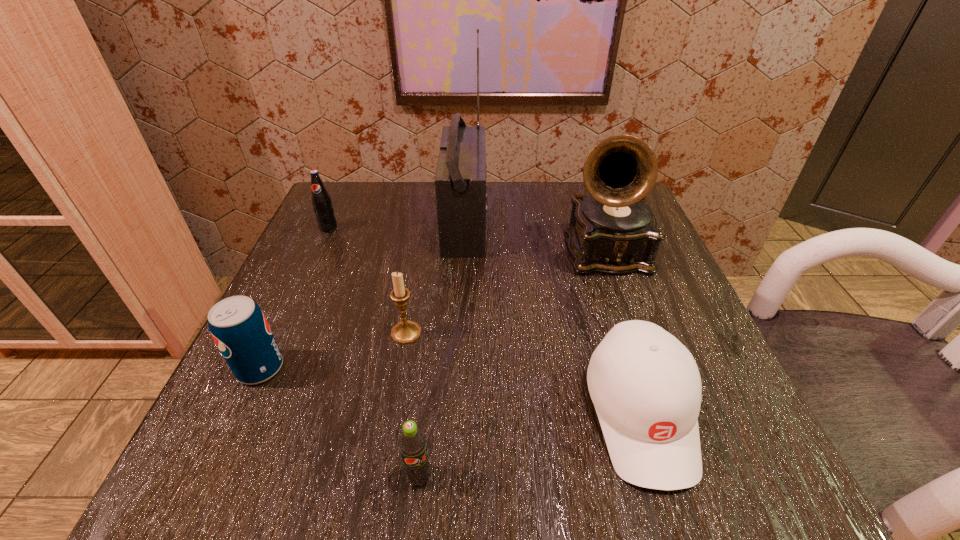
This screenshot has width=960, height=540. In order to click on object situated at the far left corner in this screenshot , I will do `click(322, 204)`.

In order to click on object located in the far right corner section of the desktop in this screenshot , I will do `click(614, 231)`.

Identify the location of object positioned at the near right corner. (645, 385).

Locate an element on the screen. Image resolution: width=960 pixels, height=540 pixels. free space at the far edge of the desktop is located at coordinates (505, 184).

At what (x,y) coordinates should I click in order to perform the action: click on vacant region at the near edge of the desktop. Please return your answer as a coordinate pair (x, y). This screenshot has height=540, width=960. Looking at the image, I should click on (422, 429).

Find the location of a particular element. This screenshot has height=540, width=960. vacant space at the left edge is located at coordinates (367, 248).

Image resolution: width=960 pixels, height=540 pixels. In the image, there is a desktop. In order to click on vacant space at the far left corner in this screenshot , I will do `click(377, 198)`.

Identify the location of vacant space at the near right corner of the desktop. (733, 428).

The height and width of the screenshot is (540, 960). I want to click on free spot between the second nearest soda and the nearest soda, so click(340, 423).

At what (x,y) coordinates should I click in order to perform the action: click on empty space that is in between the tallest object and the phonograph record. Please return your answer as a coordinate pair (x, y). The image size is (960, 540). Looking at the image, I should click on (535, 238).